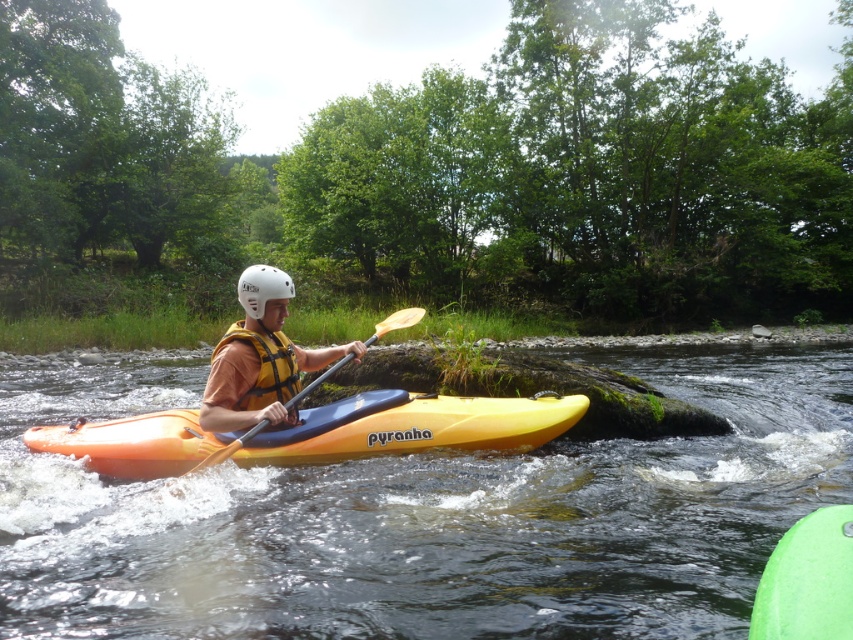
Question: Is orange matte kayak at center further to camera compared to yellow/yellowish-orange fabric life jacket at center?

Choices:
 (A) no
 (B) yes

Answer: (A)

Question: Which object appears farthest from the camera in this image?

Choices:
 (A) orange plastic kayak at center
 (B) yellow/yellowish-orange fabric life jacket at center
 (C) yellow matte paddle at center
 (D) yellow matte kayak at center

Answer: (B)

Question: Can you confirm if orange plastic kayak at center is positioned below yellow matte kayak at center?

Choices:
 (A) no
 (B) yes

Answer: (B)

Question: Can you confirm if orange plastic kayak at center is positioned to the right of orange matte kayak at center?

Choices:
 (A) yes
 (B) no

Answer: (B)

Question: Which is nearer to the yellow matte kayak at center?

Choices:
 (A) white matte helmet at center
 (B) orange matte kayak at center
 (C) yellow/yellowish-orange fabric life jacket at center

Answer: (C)

Question: Based on their relative distances, which object is nearer to the white matte helmet at center?

Choices:
 (A) yellow matte paddle at center
 (B) orange plastic kayak at center
 (C) yellow matte kayak at center
 (D) orange matte kayak at center

Answer: (C)